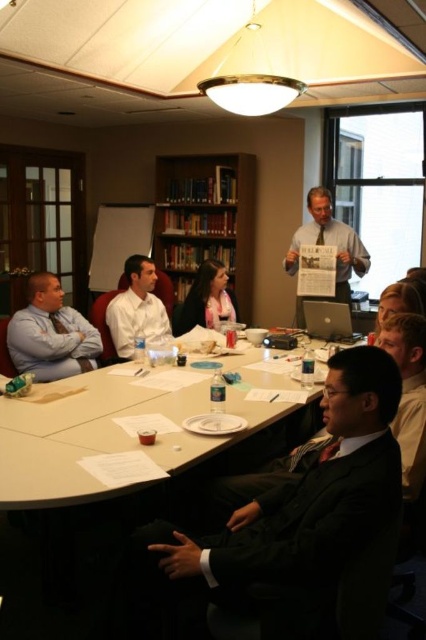
You are standing in the conference room and want to move from the point at coordinates (331, 237) to the point at (124, 317). Which direction should you move to get closer to your destination?

You should move forward because the point at coordinates (331, 237) is further away from you than the point at (124, 317).

You are standing at the entrance of the conference room and see the point marked at coordinates (305,512). What is the object located at that point?

The point at coordinates (305,512) marks the dark suit at center.